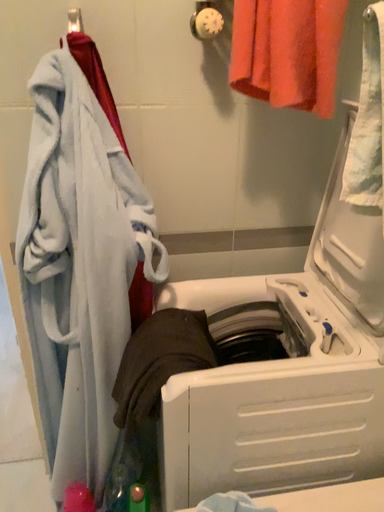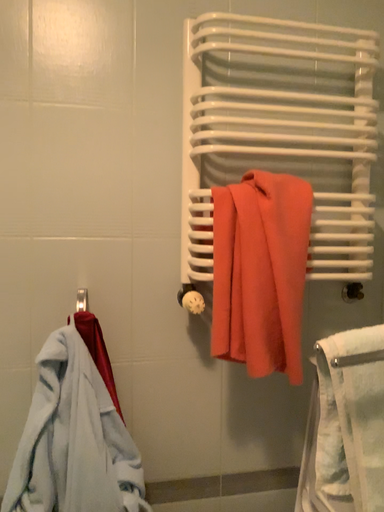
Question: Which way did the camera rotate in the video?

Choices:
 (A) rotated upward
 (B) rotated downward

Answer: (A)